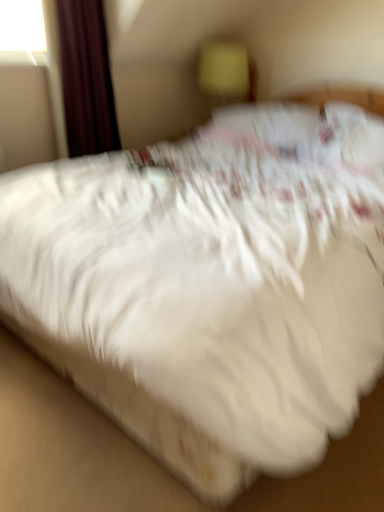
Question: From a real-world perspective, relative to dark red velvet curtain at upper left, is yellow fabric at upper center vertically above or below?

Choices:
 (A) above
 (B) below

Answer: (B)

Question: In terms of size, does yellow fabric at upper center appear bigger or smaller than dark red velvet curtain at upper left?

Choices:
 (A) big
 (B) small

Answer: (B)

Question: Visually, is yellow fabric at upper center positioned to the left or to the right of dark red velvet curtain at upper left?

Choices:
 (A) right
 (B) left

Answer: (A)

Question: Is point (72, 141) positioned closer to the camera than point (231, 88)?

Choices:
 (A) closer
 (B) farther

Answer: (A)

Question: Based on their sizes in the image, would you say dark red velvet curtain at upper left is bigger or smaller than yellow fabric at upper center?

Choices:
 (A) big
 (B) small

Answer: (A)

Question: Is dark red velvet curtain at upper left inside the boundaries of yellow fabric at upper center, or outside?

Choices:
 (A) outside
 (B) inside

Answer: (A)

Question: From a real-world perspective, is dark red velvet curtain at upper left positioned above or below yellow fabric at upper center?

Choices:
 (A) below
 (B) above

Answer: (B)